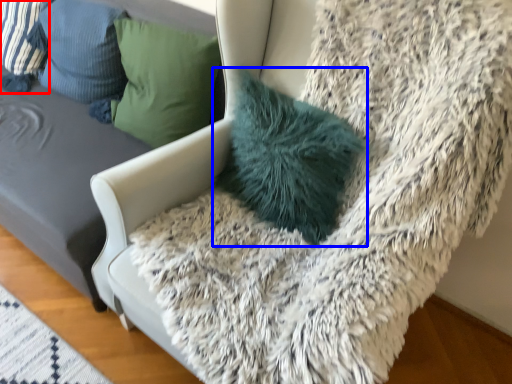
Question: Which object appears farthest to the camera in this image, pillow (highlighted by a red box) or pillow (highlighted by a blue box)?

Choices:
 (A) pillow
 (B) pillow

Answer: (A)